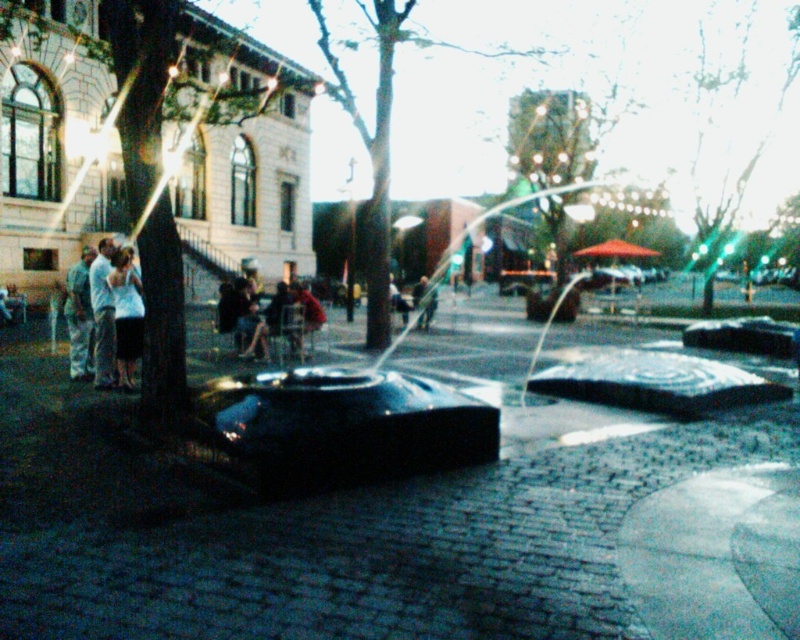
You are standing in the plaza looking at the fountain. There are two points marked on the fountain structure. Which point, point [106,356] or point [90,285], is closer to you?

Point [106,356] is closer to you since it is closer to the camera than point [90,285].

You are standing in the plaza and want to take a photo of the light blue denim jeans at left. Where should you position yourself to capture it in the frame?

To capture the light blue denim jeans at left in your photo, position yourself such that the jeans are centered at the lower left portion of your frame, corresponding to coordinates approximately 0.491 on the x and 0.129 on the y axis.

You are standing at the point with coordinates (337, 426) in the plaza. What object are you standing on?

The point at coordinates (337, 426) corresponds to the black polished water feature at center.